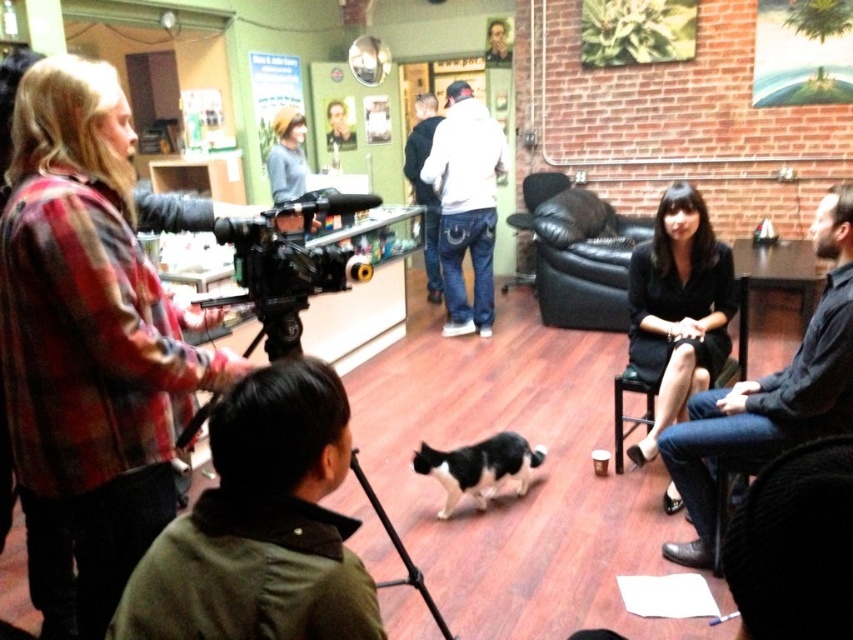
Question: Which is farther from the black satin dress at center?

Choices:
 (A) flannel shirt at left
 (B) dark blue jeans at center
 (C) black leather couch at center
 (D) black plastic video camera at left

Answer: (B)

Question: Is black leather chair at lower right to the left of black leather chair at center from the viewer's perspective?

Choices:
 (A) no
 (B) yes

Answer: (A)

Question: Is black plastic video camera at left to the right of black matte tripod at lower center from the viewer's perspective?

Choices:
 (A) no
 (B) yes

Answer: (A)

Question: Estimate the real-world distances between objects in this image. Which object is farther from the black satin dress at center?

Choices:
 (A) white cotton hoodie at center
 (B) black plastic video camera at left

Answer: (A)

Question: Which point is farther to the camera?

Choices:
 (A) black leather chair at lower right
 (B) flannel shirt at left

Answer: (A)

Question: Can you confirm if black leather couch at center is positioned to the right of black leather chair at center?

Choices:
 (A) yes
 (B) no

Answer: (A)